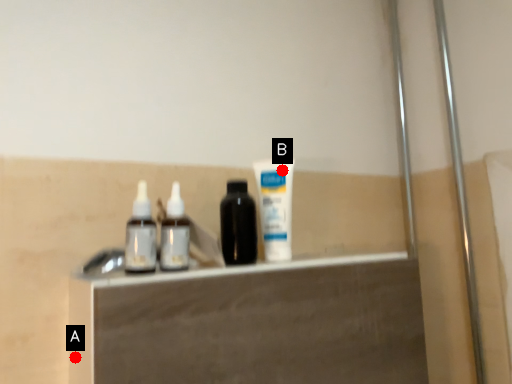
Question: Two points are circled on the image, labeled by A and B beside each circle. Which of the following is the closest to the observer?

Choices:
 (A) A is closer
 (B) B is closer

Answer: (A)